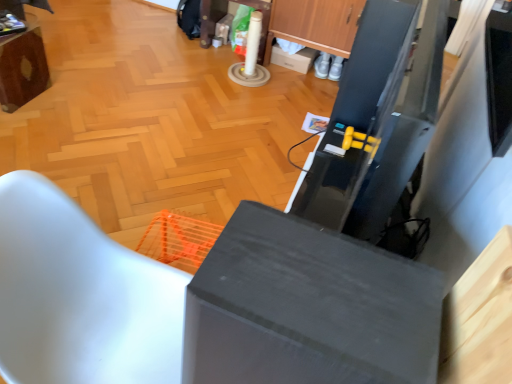
Question: Is white matte chair at lower left, marked as the 1th furniture in a bottom-to-top arrangement, far from wooden cabinet at upper center?

Choices:
 (A) no
 (B) yes

Answer: (B)

Question: Can you confirm if white matte chair at lower left, positioned as the 1th furniture in right-to-left order, is bigger than wooden cabinet at upper center?

Choices:
 (A) yes
 (B) no

Answer: (A)

Question: From the image's perspective, is white matte chair at lower left, arranged as the 2th furniture when viewed from the top, located above wooden cabinet at upper center?

Choices:
 (A) no
 (B) yes

Answer: (A)

Question: Can you confirm if white matte chair at lower left, the 2th furniture in the back-to-front sequence, is shorter than wooden cabinet at upper center?

Choices:
 (A) yes
 (B) no

Answer: (B)

Question: Does white matte chair at lower left, arranged as the 2th furniture when viewed from the top, have a greater width compared to wooden cabinet at upper center?

Choices:
 (A) no
 (B) yes

Answer: (B)

Question: Is point (414, 311) positioned closer to the camera than point (48, 72)?

Choices:
 (A) farther
 (B) closer

Answer: (B)

Question: Which is correct: matte gray cabinet at center is inside wooden table at upper left, which is the 2th furniture from bottom to top, or outside of it?

Choices:
 (A) inside
 (B) outside

Answer: (B)

Question: From a real-world perspective, is matte gray cabinet at center physically located above or below wooden table at upper left, arranged as the 2th furniture when viewed from the front?

Choices:
 (A) above
 (B) below

Answer: (A)

Question: Is matte gray cabinet at center bigger or smaller than wooden table at upper left, the 1th furniture viewed from the left?

Choices:
 (A) small
 (B) big

Answer: (B)

Question: From the image's perspective, is white matte chair at lower left, arranged as the 2th furniture when viewed from the top, above or below wooden table at upper left, arranged as the 2th furniture when viewed from the right?

Choices:
 (A) below
 (B) above

Answer: (A)

Question: Considering the positions of white matte chair at lower left, arranged as the first furniture when viewed from the front, and wooden table at upper left, which is the 2th furniture from bottom to top, in the image, is white matte chair at lower left, arranged as the first furniture when viewed from the front, taller or shorter than wooden table at upper left, which is the 2th furniture from bottom to top,?

Choices:
 (A) tall
 (B) short

Answer: (A)

Question: From a real-world perspective, is white matte chair at lower left, the 2th furniture in the back-to-front sequence, physically located above or below wooden table at upper left, which is the 2th furniture from bottom to top?

Choices:
 (A) below
 (B) above

Answer: (B)

Question: Looking at their shapes, would you say white matte chair at lower left, the second furniture when ordered from left to right, is wider or thinner than wooden table at upper left, placed as the first furniture when sorted from top to bottom?

Choices:
 (A) thin
 (B) wide

Answer: (B)

Question: From the image's perspective, is white cardboard box at center located above or below white matte chair at lower left, the second furniture when ordered from left to right?

Choices:
 (A) below
 (B) above

Answer: (B)

Question: Is white cardboard box at center wider or thinner than white matte chair at lower left, marked as the 1th furniture in a bottom-to-top arrangement?

Choices:
 (A) wide
 (B) thin

Answer: (B)